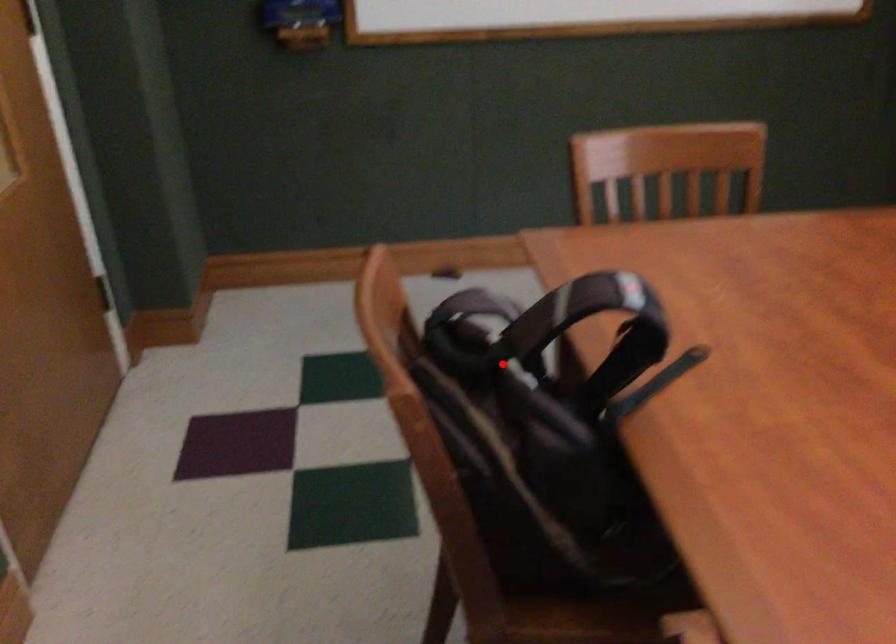
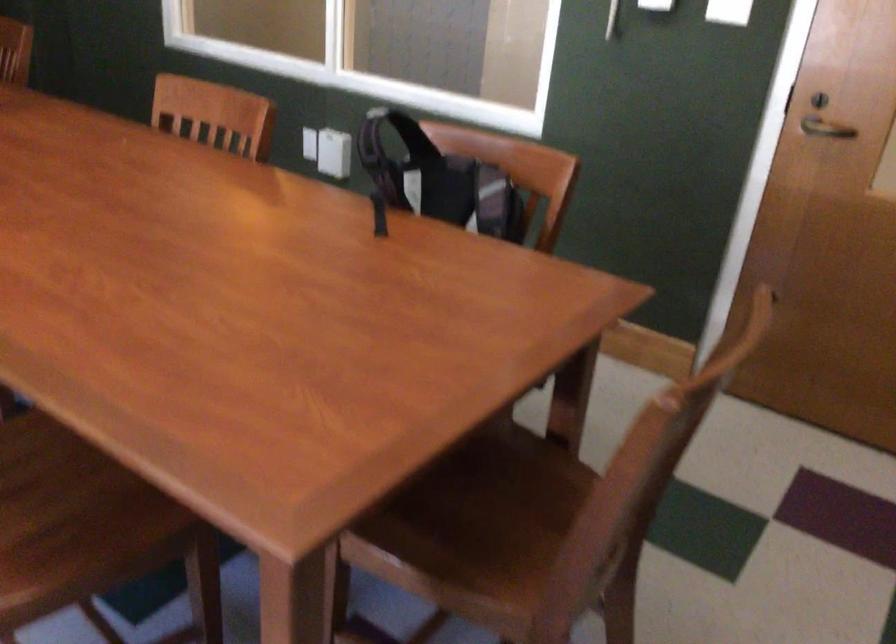
Question: I am providing you with two images of the same scene from different viewpoints. In image1, a red point is highlighted. Considering the same 3D point in image2, which of the following is correct?

Choices:
 (A) It is closer
 (B) It is farther

Answer: (B)